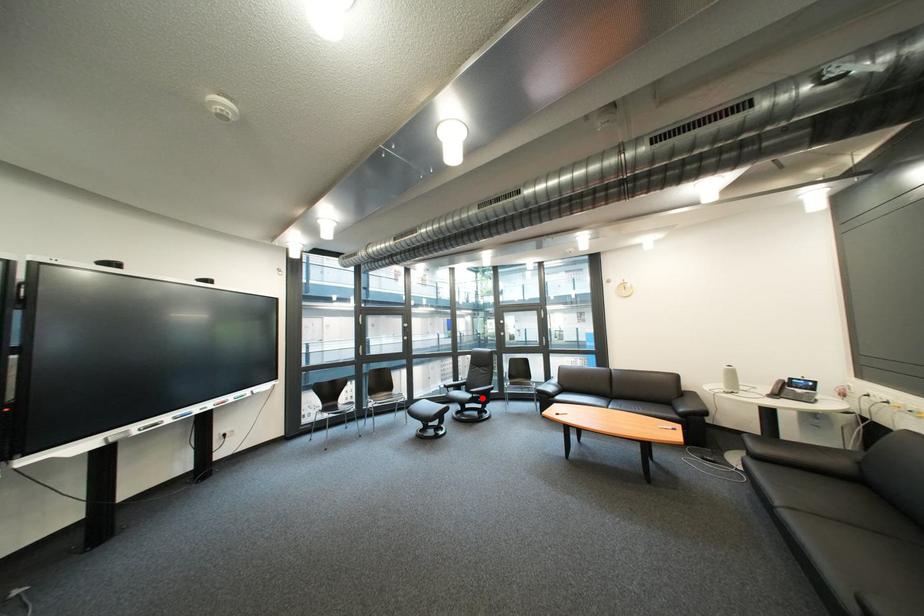
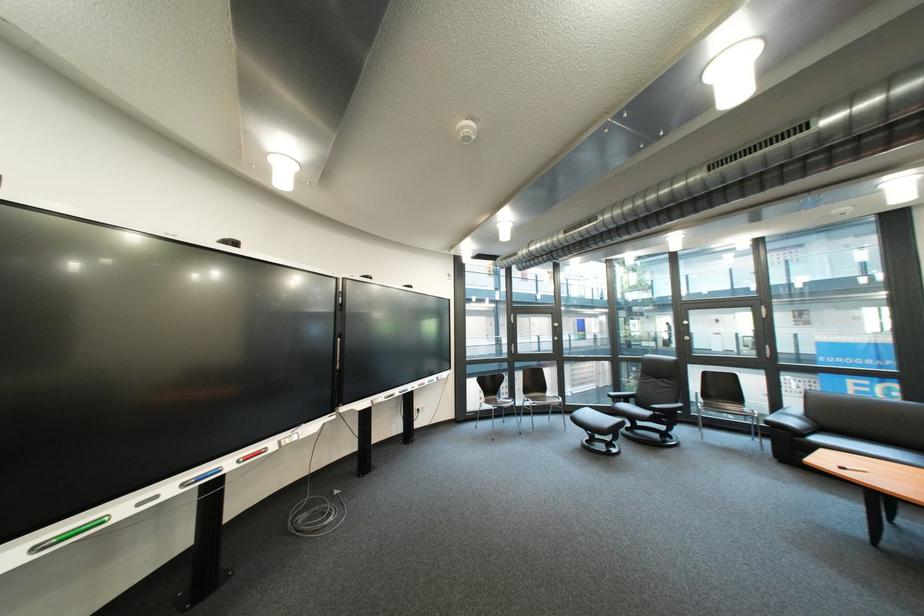
Question: A red point is marked in image1. In image2, is the corresponding 3D point closer to the camera or farther? Reply with the corresponding letter.

Choices:
 (A) The corresponding 3D point is closer.
 (B) The corresponding 3D point is farther.

Answer: (A)